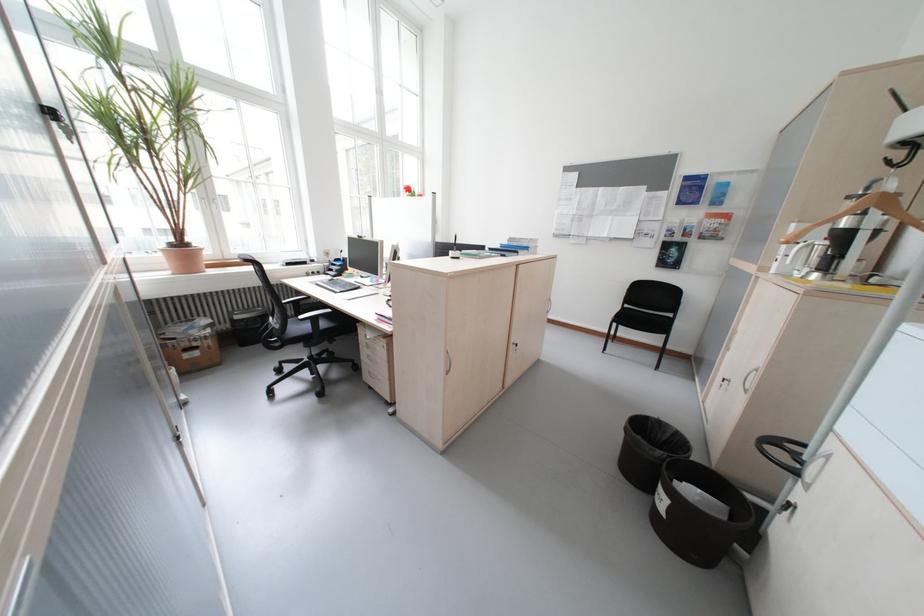
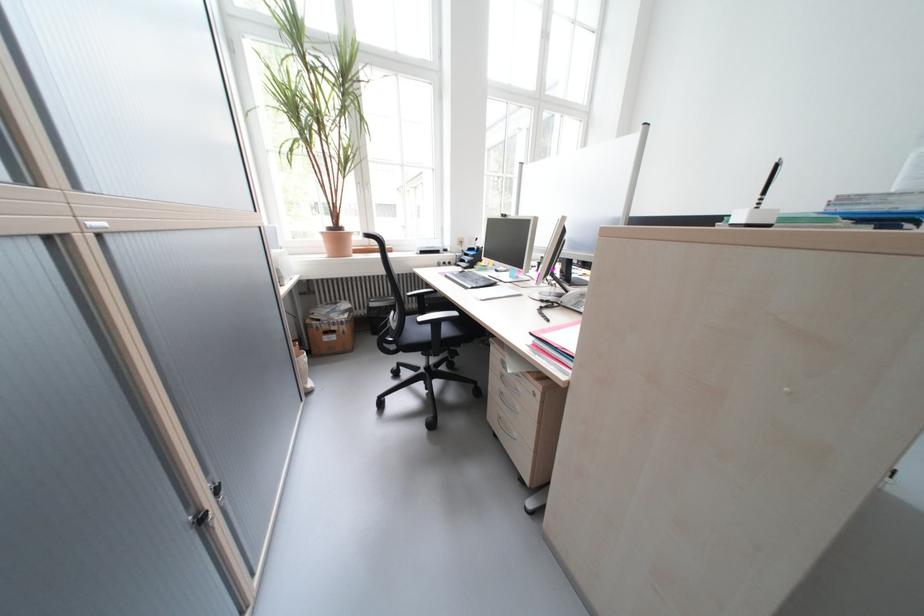
Where in the second image is the point corresponding to (x=188, y=440) from the first image?

(213, 521)